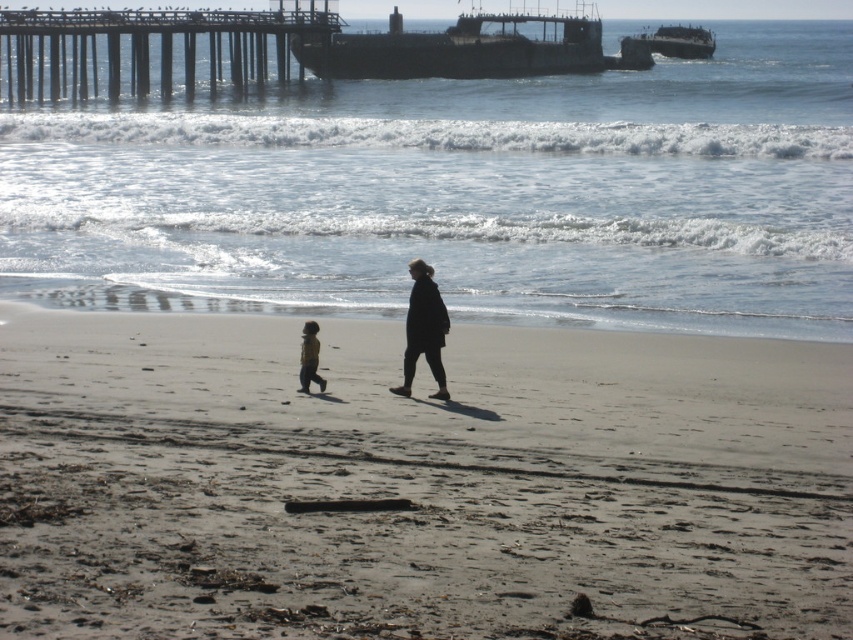
You are standing on the beach and see the smooth sand at lower center and the dark gray wool coat at center. Which object is located to the right of the other?

The smooth sand at lower center is positioned on the right side of dark gray wool coat at center.